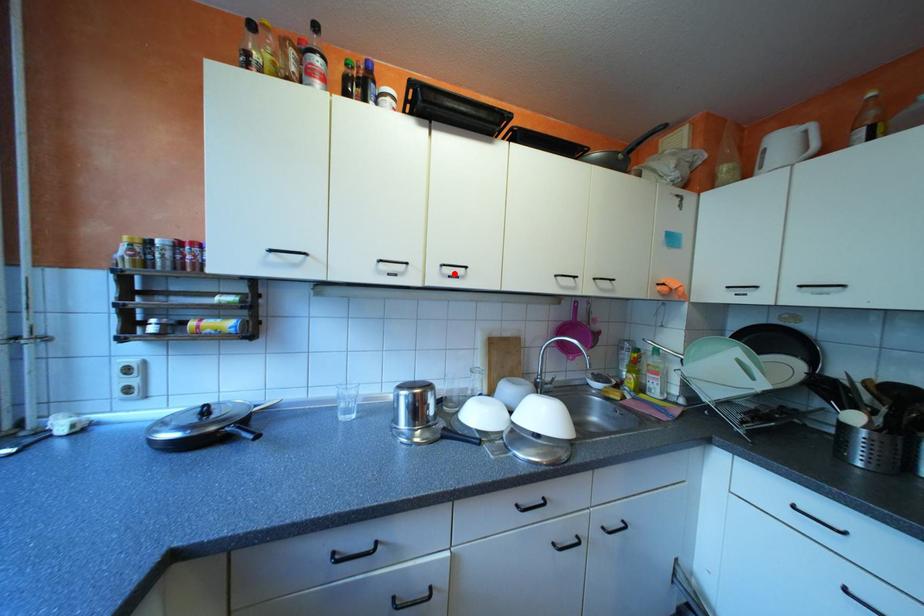
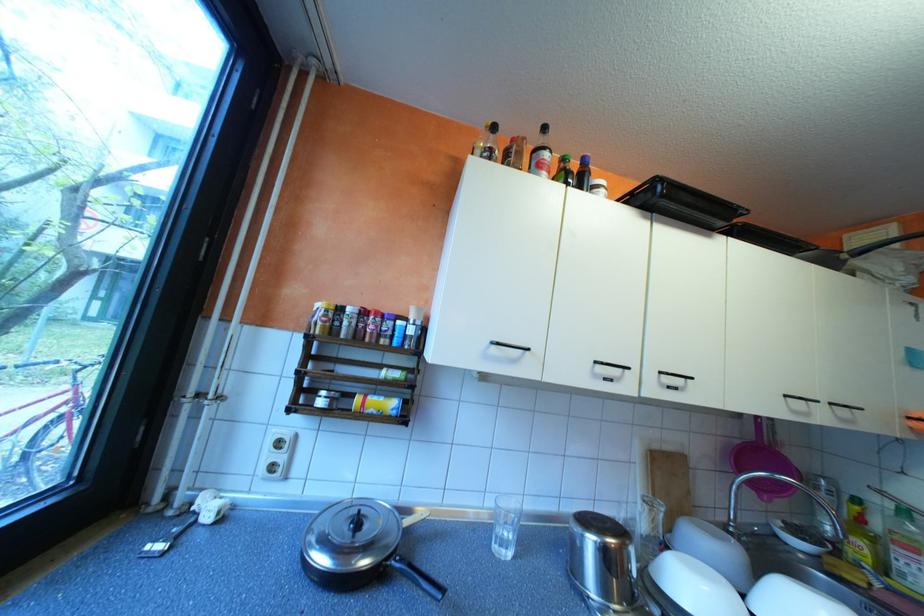
The point at the highlighted location is marked in the first image. Where is the corresponding point in the second image?

(673, 383)